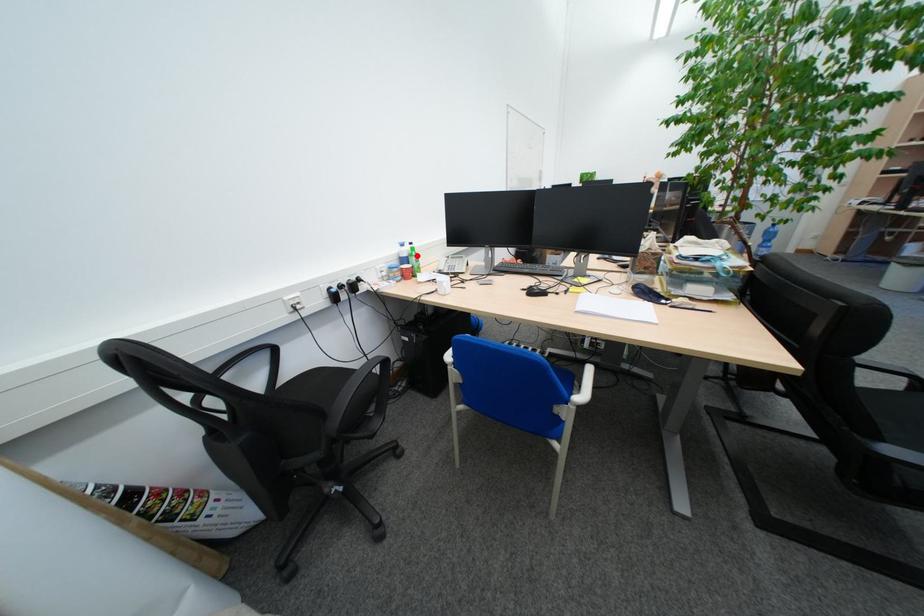
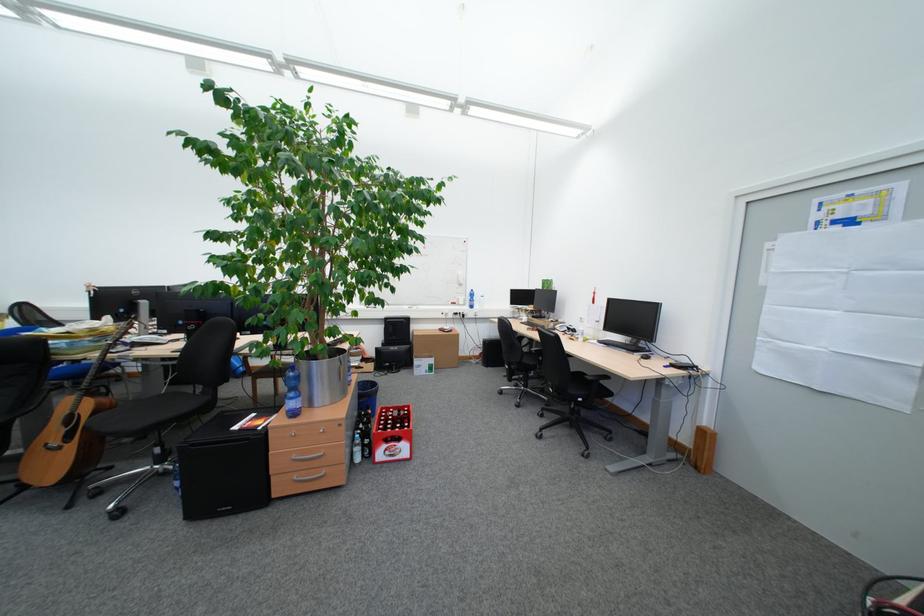
Question: I am providing you with two images of the same scene from different viewpoints. A red point is marked on the first image. Can you still see the location of the red point in image 2?

Choices:
 (A) Yes
 (B) No

Answer: (B)